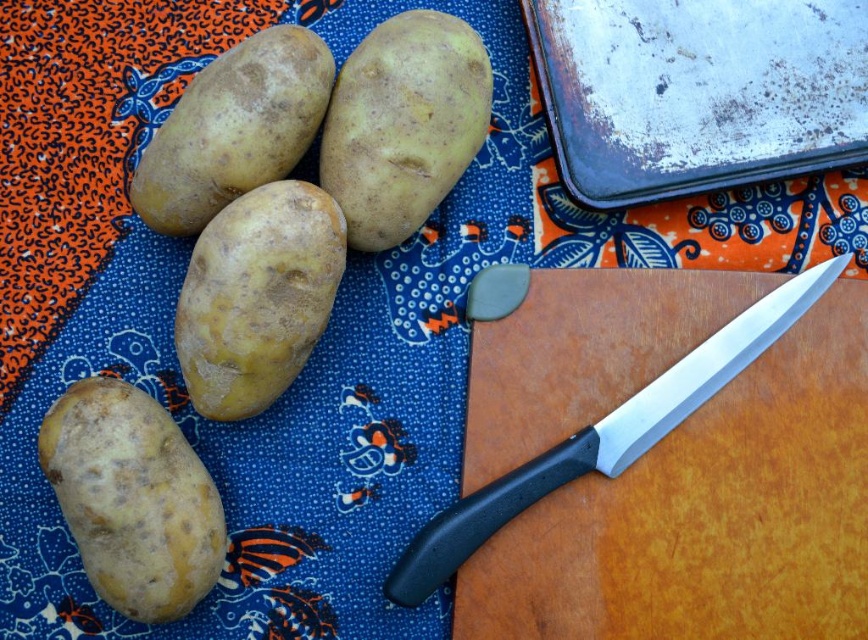
You are organizing a kitchen inventory and need to place the rusty metal tray at upper right and the smooth yellow potato at lower left onto a shelf. The shelf has a height limit of 10 cm. Can both items fit vertically on the shelf without exceeding the height limit?

The rusty metal tray at upper right is shorter than the smooth yellow potato at lower left. Since the shelf has a height limit of 10 cm, both items can fit vertically as long as the tallest item, the smooth yellow potato at lower left, is under 10 cm. However, the exact height of the potato isn

You are a chef preparing ingredients and need to place a cutting board on the fabric. The cutting board is 30 cm wide. The point marked at upper right by coordinates point [696,92] indicates the location of a rusty metal tray. Can you fit the cutting board horizontally on the fabric without overlapping the tray?

The point marked at upper right by coordinates point [696,92] indicates the location of a rusty metal tray. Since the fabric is laid out on a flat surface and the tray is at the upper right corner, there should be enough space to place the 30 cm wide cutting board horizontally on the remaining area of the fabric without overlapping the tray.

You are organizing items on a kitchen counter and have a rusty metal tray at upper right and a black plastic knife at center. Which item takes up more space on the counter?

The black plastic knife at center occupies more space than the rusty metal tray at upper right, so the black plastic knife at center takes up more space on the counter.